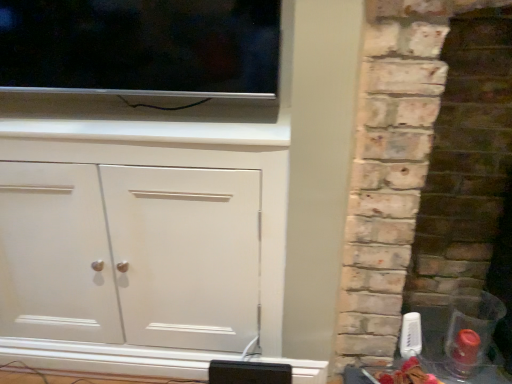
Question: Considering the positions of rustic stone fireplace at right and flat screen tv at upper left in the image, is rustic stone fireplace at right taller or shorter than flat screen tv at upper left?

Choices:
 (A) tall
 (B) short

Answer: (A)

Question: Considering their positions, is rustic stone fireplace at right located in front of or behind flat screen tv at upper left?

Choices:
 (A) behind
 (B) front

Answer: (B)

Question: Which of these objects is positioned farthest from the white matte cabinet at center?

Choices:
 (A) rustic stone fireplace at right
 (B) flat screen tv at upper left

Answer: (A)

Question: Estimate the real-world distances between objects in this image. Which object is closer to the rustic stone fireplace at right?

Choices:
 (A) white matte cabinet at center
 (B) flat screen tv at upper left

Answer: (A)